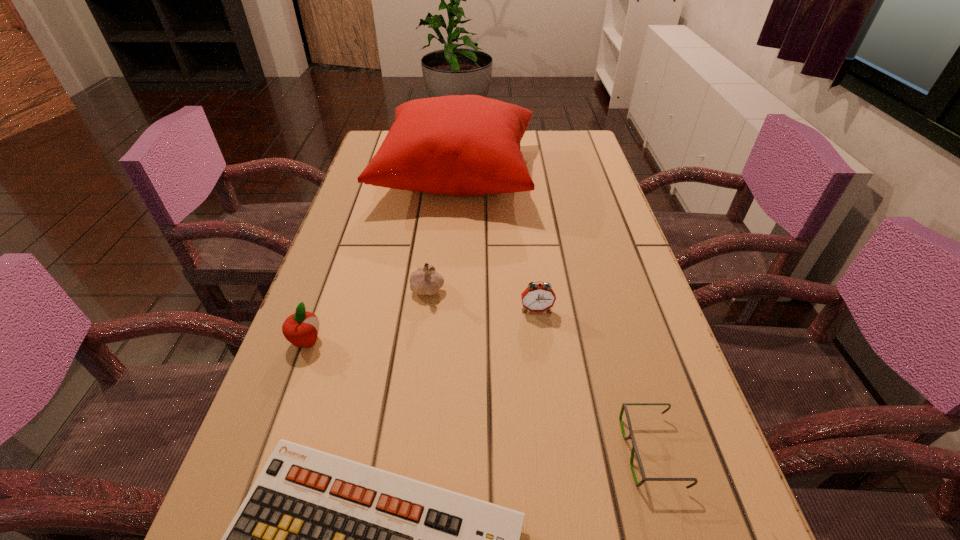
Locate an element on the screen. The image size is (960, 540). blank space located on the right of the apple is located at coordinates (492, 341).

At what (x,y) coordinates should I click in order to perform the action: click on vacant space situated 0.150m on the lens of the fifth tallest object. Please return your answer as a coordinate pair (x, y). The image size is (960, 540). Looking at the image, I should click on (533, 451).

Locate an element on the screen. The width and height of the screenshot is (960, 540). vacant space located 0.110m on the lens of the fifth tallest object is located at coordinates (558, 451).

At what (x,y) coordinates should I click in order to perform the action: click on vacant region located on the lens of the fifth tallest object. Please return your answer as a coordinate pair (x, y). Looking at the image, I should click on (407, 451).

Identify the location of object that is positioned at the far edge. This screenshot has height=540, width=960. (463, 145).

At what (x,y) coordinates should I click in order to perform the action: click on cushion situated at the left edge. Please return your answer as a coordinate pair (x, y). Image resolution: width=960 pixels, height=540 pixels. Looking at the image, I should click on (463, 145).

The image size is (960, 540). What are the coordinates of `apple at the left edge` in the screenshot? It's located at (301, 329).

The width and height of the screenshot is (960, 540). I want to click on object that is at the right edge, so pyautogui.click(x=634, y=449).

Locate an element on the screen. object that is at the far left corner is located at coordinates (463, 145).

In the image, there is a desktop. Where is `vacant space at the left edge`? This screenshot has width=960, height=540. vacant space at the left edge is located at coordinates (396, 198).